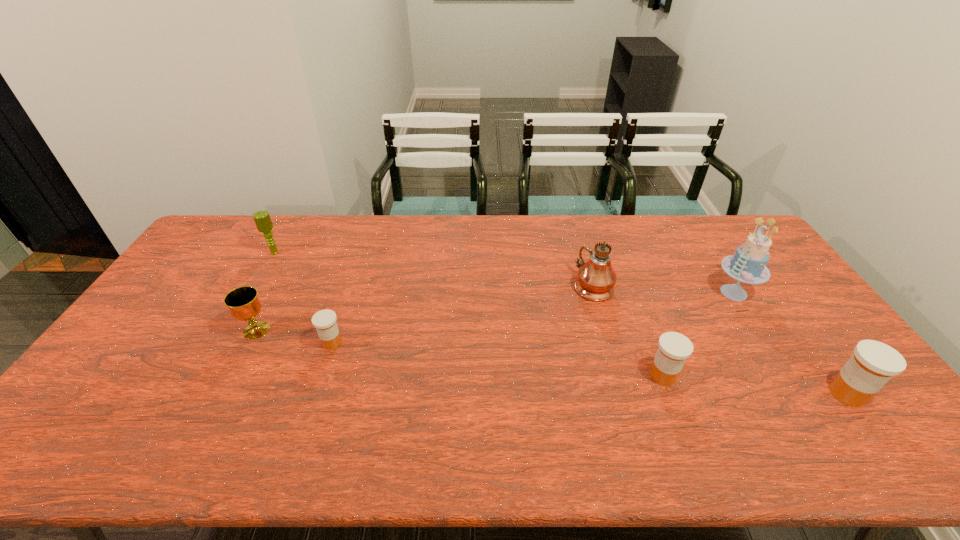
Locate an element on the screen. The width and height of the screenshot is (960, 540). free space between the third object from right to left and the oil lamp is located at coordinates (628, 331).

Find the location of a particular element. The width and height of the screenshot is (960, 540). vacant point located between the second object from left to right and the fifth object from right to left is located at coordinates (295, 336).

This screenshot has height=540, width=960. What are the coordinates of `vacant point located between the cake and the third object from right to left` in the screenshot? It's located at (698, 334).

The image size is (960, 540). I want to click on vacant space that's between the rightmost object and the leftmost object, so click(562, 323).

Where is `vacant point located between the second shortest medicine and the tallest medicine`? This screenshot has height=540, width=960. vacant point located between the second shortest medicine and the tallest medicine is located at coordinates (755, 384).

Locate an element on the screen. vacant area between the farthest object and the leftmost medicine is located at coordinates (303, 298).

Find the location of a particular element. The image size is (960, 540). vacant area that lies between the shortest object and the fifth object from left to right is located at coordinates (497, 359).

Identify the location of free space between the fifth object from left to right and the shortest object. (497, 359).

Where is `free area in between the chalice and the second object from right to left`? Image resolution: width=960 pixels, height=540 pixels. free area in between the chalice and the second object from right to left is located at coordinates (495, 312).

Find the location of `blank region between the fourth object from right to left and the microphone`. blank region between the fourth object from right to left and the microphone is located at coordinates (434, 269).